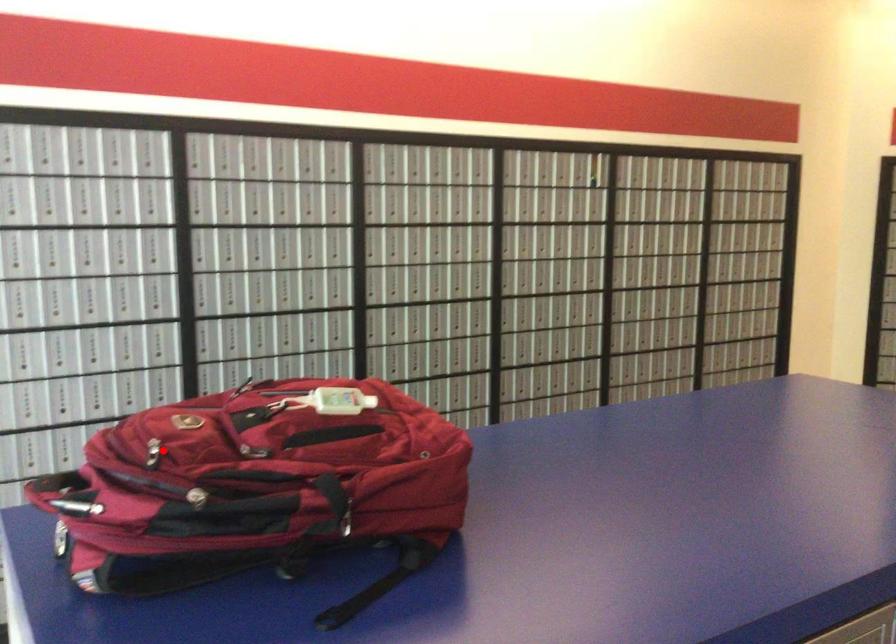
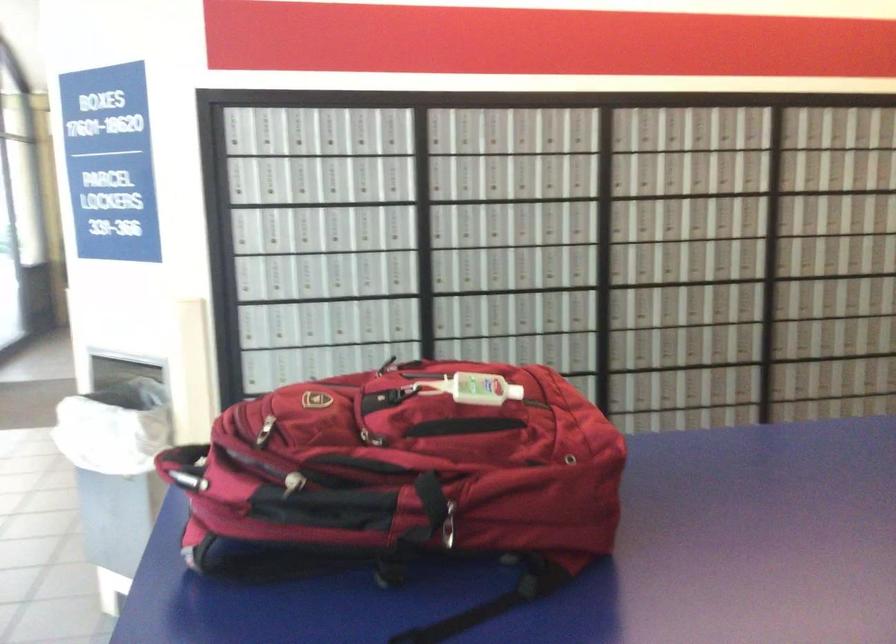
Where in the second image is the point corresponding to the highlighted location from the first image?

(264, 430)